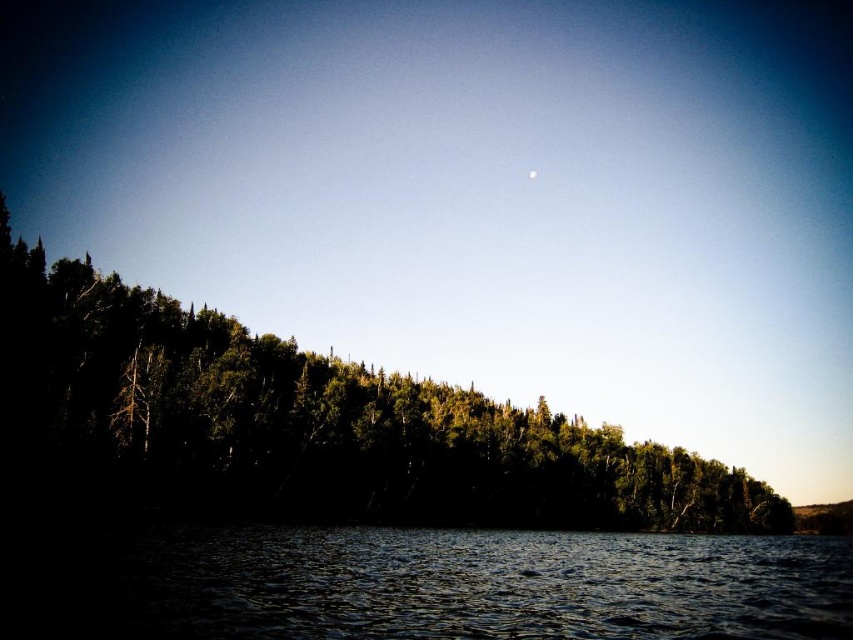
Question: Is green leafy trees at center bigger than white glossy moon at upper center?

Choices:
 (A) no
 (B) yes

Answer: (B)

Question: Is dark blue water at lower center to the right of white glossy moon at upper center from the viewer's perspective?

Choices:
 (A) no
 (B) yes

Answer: (A)

Question: Which point is farther to the camera?

Choices:
 (A) green leafy trees at center
 (B) white glossy moon at upper center
 (C) dark blue water at lower center

Answer: (B)

Question: Estimate the real-world distances between objects in this image. Which object is farther from the white glossy moon at upper center?

Choices:
 (A) green leafy trees at center
 (B) dark blue water at lower center

Answer: (B)

Question: Is green leafy trees at center positioned behind white glossy moon at upper center?

Choices:
 (A) yes
 (B) no

Answer: (B)

Question: Which point is farther to the camera?

Choices:
 (A) (84, 349)
 (B) (529, 173)

Answer: (B)